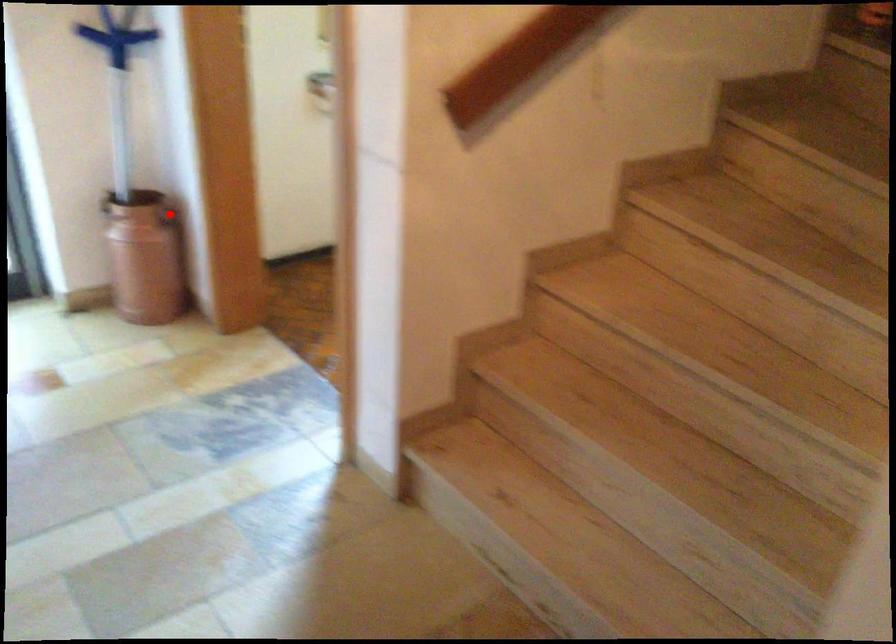
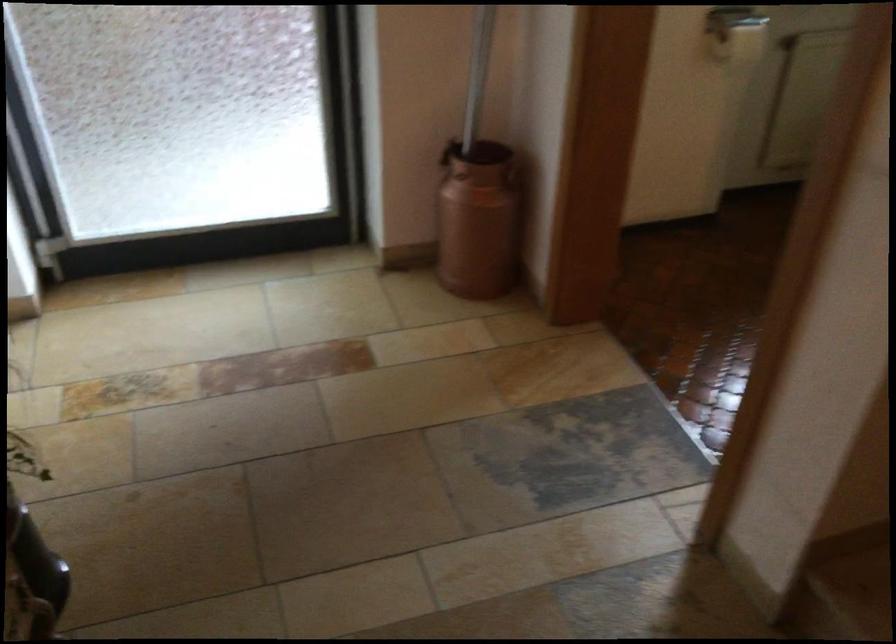
Find the pixel in the second image that matches the highlighted location in the first image.

(513, 176)